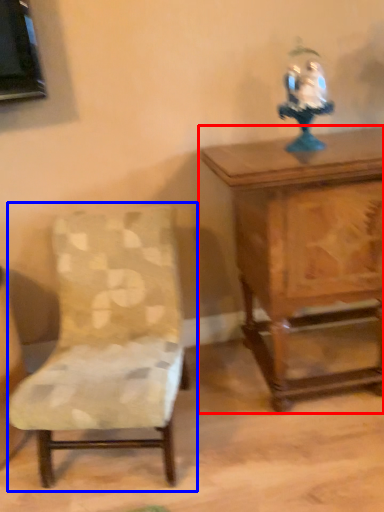
Question: Which object is further to the camera taking this photo, table (highlighted by a red box) or chair (highlighted by a blue box)?

Choices:
 (A) table
 (B) chair

Answer: (A)